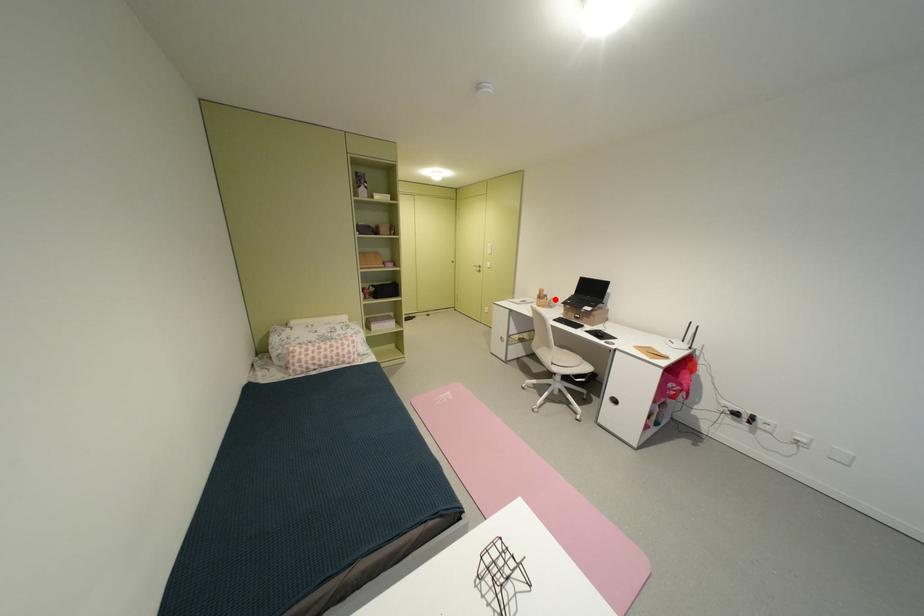
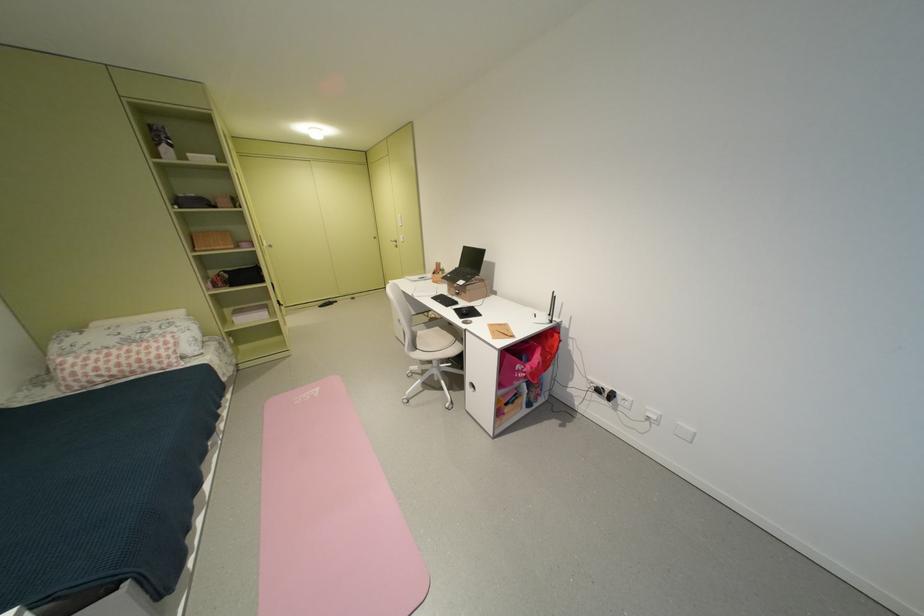
The point at the highlighted location is marked in the first image. Where is the corresponding point in the second image?

(450, 274)